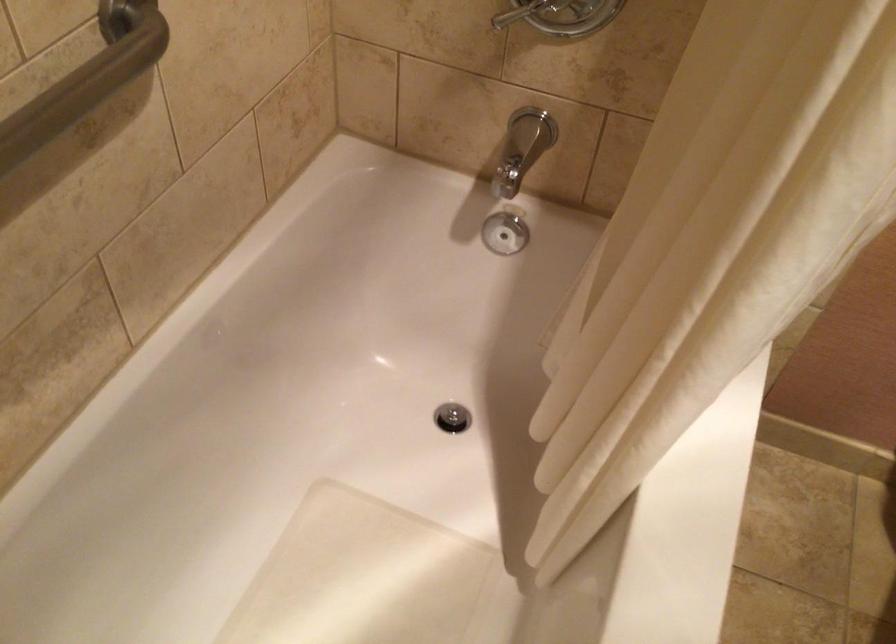
The first image is from the beginning of the video and the second image is from the end. How did the camera likely rotate when shooting the video?

The camera's rotation is toward right-down.